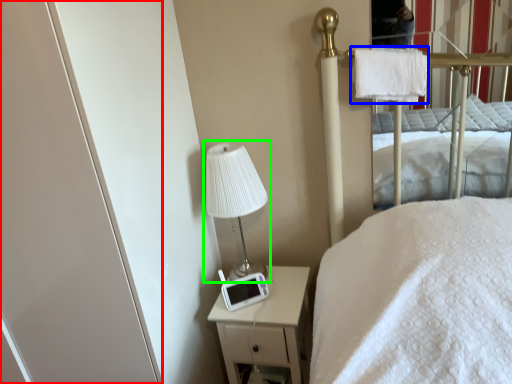
Question: Considering the real-world distances, which object is farthest from screen door (highlighted by a red box)? cloth (highlighted by a blue box) or table lamp (highlighted by a green box)?

Choices:
 (A) cloth
 (B) table lamp

Answer: (A)